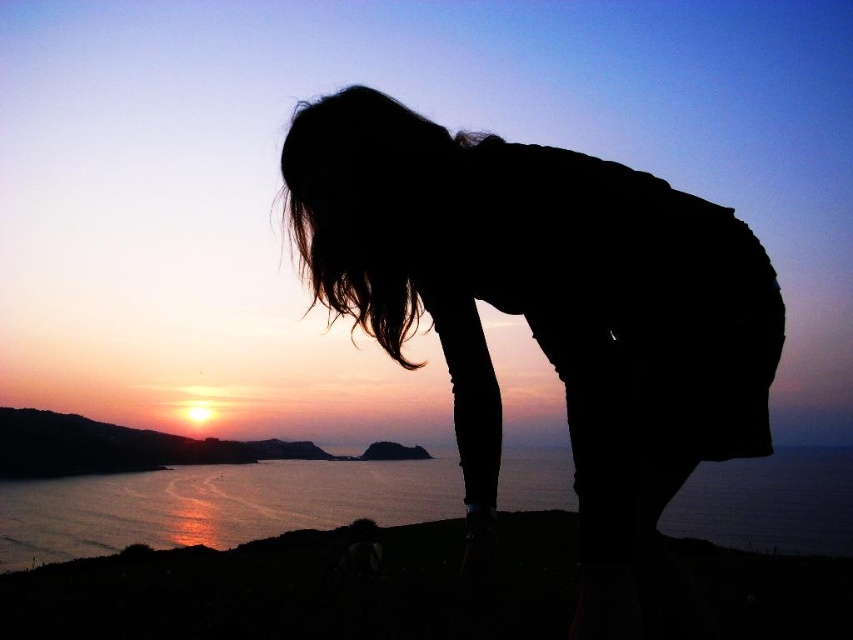
Can you confirm if silhouette figure at center is positioned above glistening water at lower left?

Yes, silhouette figure at center is above glistening water at lower left.

Does silhouette figure at center have a greater width compared to glistening water at lower left?

No, silhouette figure at center is not wider than glistening water at lower left.

Which is in front, point (672, 420) or point (555, 472)?

Positioned in front is point (672, 420).

Identify the location of silhouette figure at center. The image size is (853, 640). (544, 296).